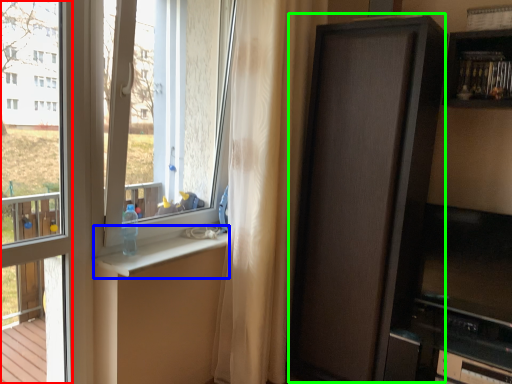
Question: Estimate the real-world distances between objects in this image. Which object is farther from window frame (highlighted by a red box), window sill (highlighted by a blue box) or screen door (highlighted by a green box)?

Choices:
 (A) window sill
 (B) screen door

Answer: (B)